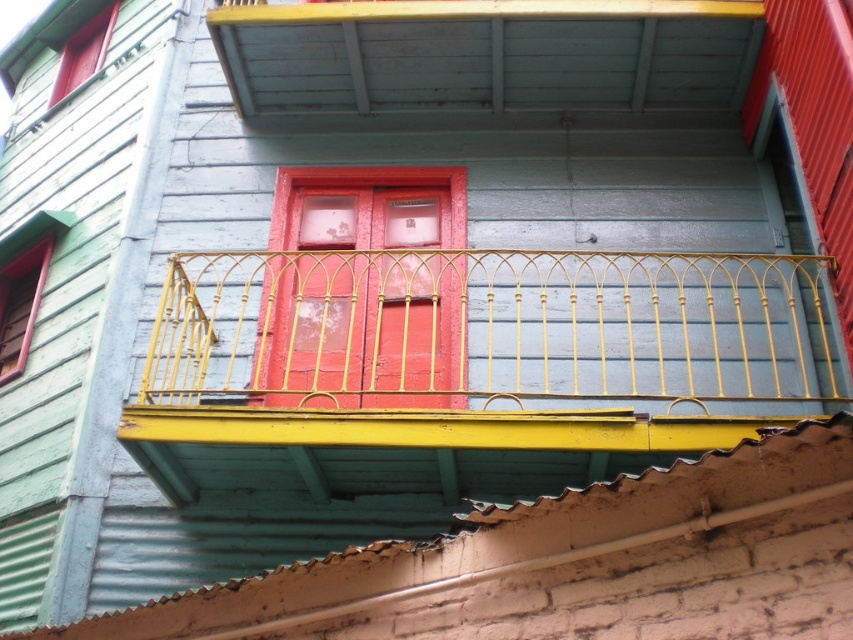
Question: Which object is closer to the camera taking this photo?

Choices:
 (A) matte red window at left
 (B) gold wrought iron balcony at center
 (C) smooth red door at center
 (D) matte red window at upper left

Answer: (B)

Question: Which point is closer to the camera?

Choices:
 (A) (183, 284)
 (B) (444, 260)

Answer: (A)

Question: Can you confirm if gold wrought iron balcony at center is wider than matte red window at upper left?

Choices:
 (A) no
 (B) yes

Answer: (B)

Question: Can you confirm if smooth red door at center is wider than matte red window at upper left?

Choices:
 (A) no
 (B) yes

Answer: (B)

Question: Which object is closer to the camera taking this photo?

Choices:
 (A) matte red window at left
 (B) gold wrought iron balcony at center
 (C) matte red window at upper left
 (D) smooth red door at center

Answer: (B)

Question: Is matte red window at left positioned at the back of matte red window at upper left?

Choices:
 (A) no
 (B) yes

Answer: (A)